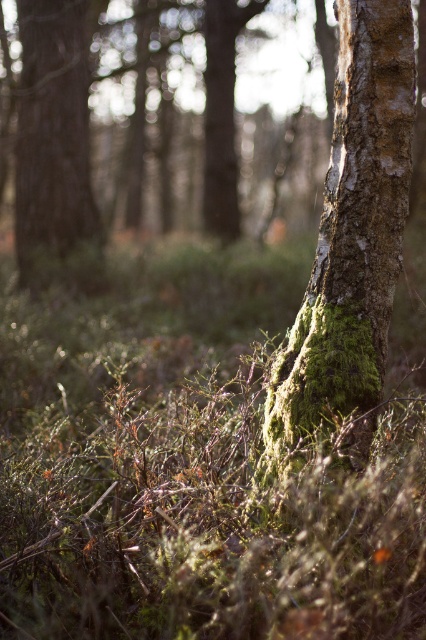
Is the position of green mossy grass at center less distant than that of brown rough tree trunk at left?

That is True.

Between point (262, 285) and point (29, 241), which one is positioned in front?

Point (262, 285) is in front.

This screenshot has width=426, height=640. Find the location of `green mossy grass at center`. green mossy grass at center is located at coordinates (195, 461).

Between green mossy bark at center and brown rough tree trunk at left, which one is positioned higher?

Positioned higher is brown rough tree trunk at left.

Does green mossy bark at center have a greater height compared to brown rough tree trunk at left?

In fact, green mossy bark at center may be shorter than brown rough tree trunk at left.

Which is behind, point (360, 323) or point (16, 192)?

The point (16, 192) is behind.

Find the location of `green mossy bark at center`. green mossy bark at center is located at coordinates (351, 243).

Which is below, green mossy grass at center or green mossy bark at center?

Positioned lower is green mossy grass at center.

Is green mossy grass at center above green mossy bark at center?

Actually, green mossy grass at center is below green mossy bark at center.

Identify the location of green mossy grass at center. The height and width of the screenshot is (640, 426). (195, 461).